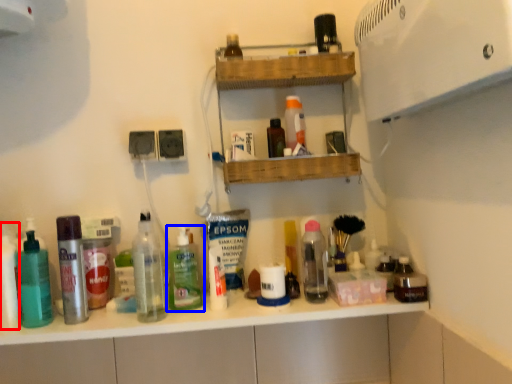
Question: Which object appears closest to the camera in this image, toiletry (highlighted by a red box) or bottle (highlighted by a blue box)?

Choices:
 (A) toiletry
 (B) bottle

Answer: (A)